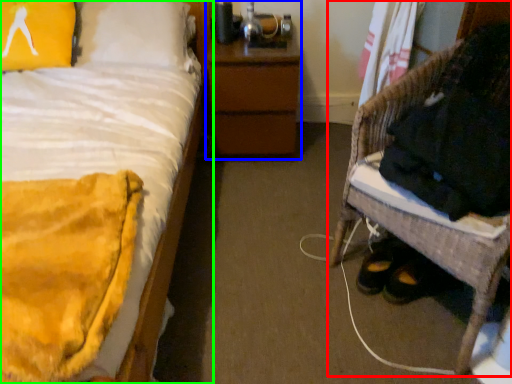
Question: Which is nearer to the furniture (highlighted by a red box)? nightstand (highlighted by a blue box) or bed (highlighted by a green box).

Choices:
 (A) nightstand
 (B) bed

Answer: (A)